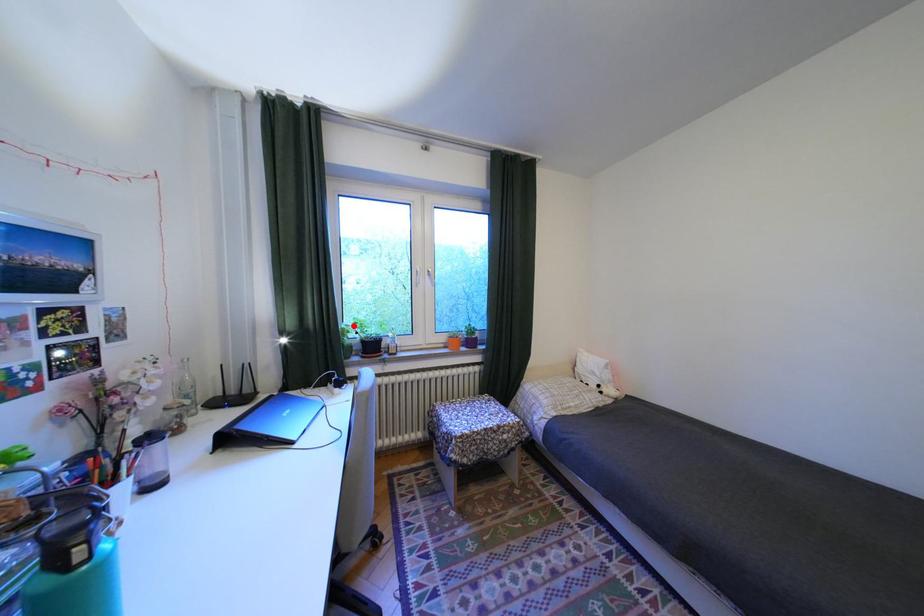
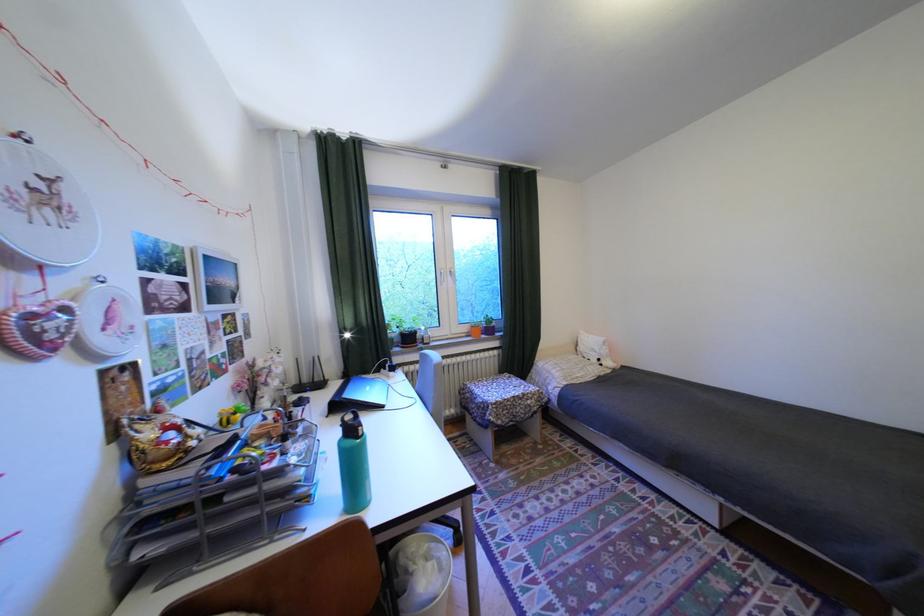
The point at the highlighted location is marked in the first image. Where is the corresponding point in the second image?

(397, 322)